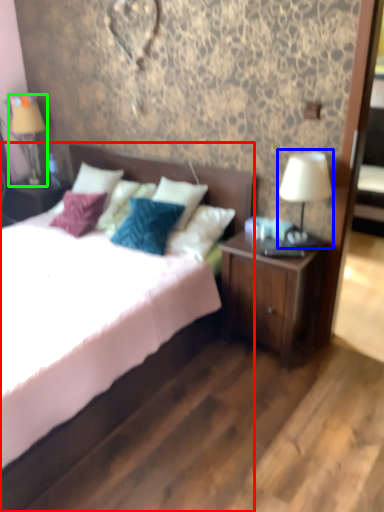
Question: Based on their relative distances, which object is farther from bed (highlighted by a red box)? Choose from table lamp (highlighted by a blue box) and table lamp (highlighted by a green box).

Choices:
 (A) table lamp
 (B) table lamp

Answer: (B)